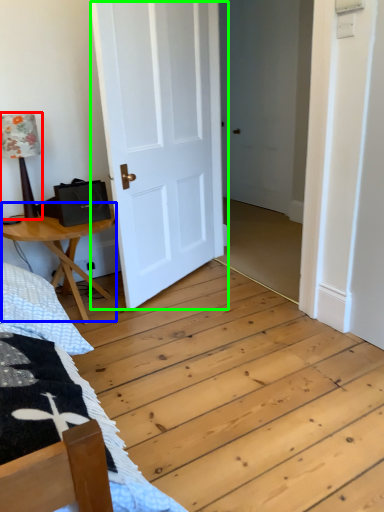
Question: Which is farther away from table lamp (highlighted by a red box)? table (highlighted by a blue box) or door (highlighted by a green box)?

Choices:
 (A) table
 (B) door

Answer: (B)